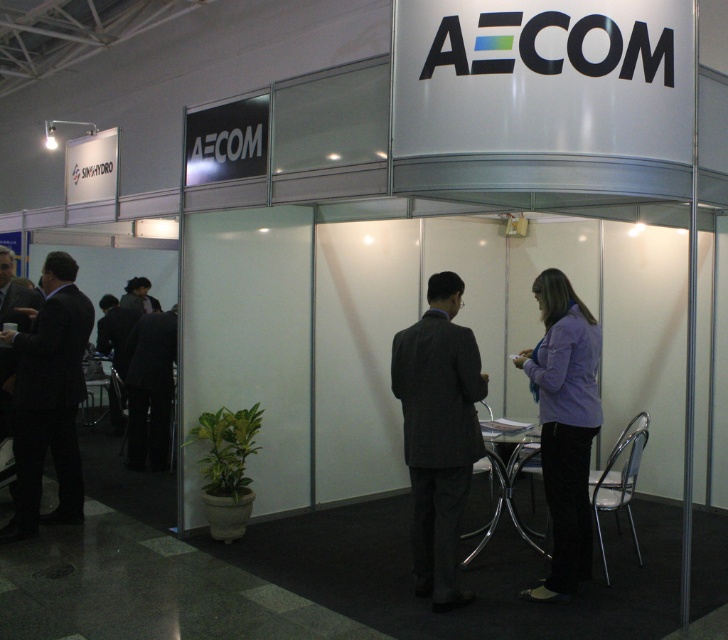
You are attending a trade show and want to approach the two people at the AECOM booth. You notice a dark gray suit at center and a dark suit at left. Which person should you approach if you want to speak with someone who is standing closer to the entrance of the booth?

The dark suit at left is closer to the entrance of the booth. However, the description provided only mentions the height difference between the two individuals, not their positions relative to the entrance. Therefore, based on the given information, we cannot determine which person is closer to the entrance.

You are at a trade show and want to approach the two people in the booth. The black suit at left and the dark suit at left are standing near each other. Which person should you approach first if you want to speak to the one closer to the entrance?

You should approach the black suit at left first because it is in front of the dark suit at left, making it closer to the entrance.